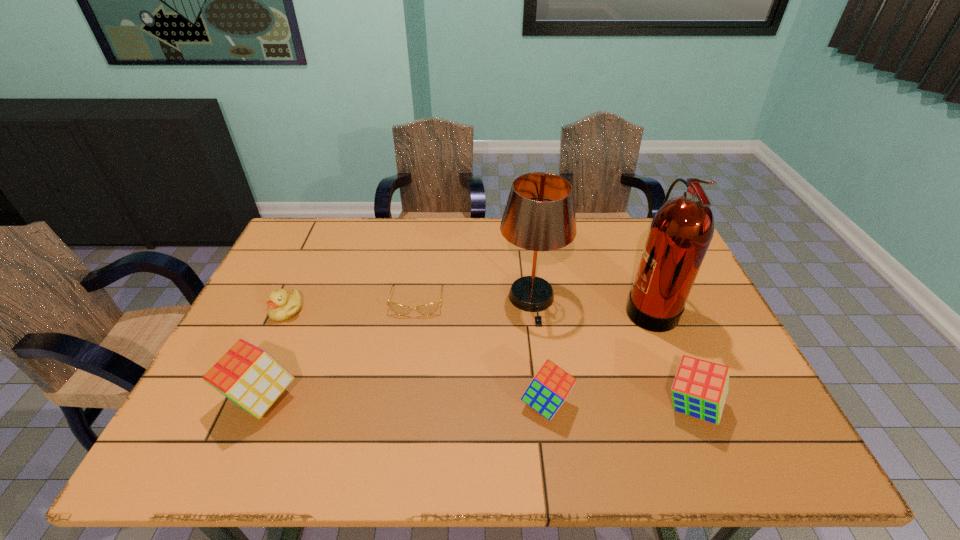
Find the location of a particular element. duckling at the left edge is located at coordinates (282, 305).

At what (x,y) coordinates should I click in order to perform the action: click on cube that is at the right edge. Please return your answer as a coordinate pair (x, y). Image resolution: width=960 pixels, height=540 pixels. Looking at the image, I should click on (700, 388).

Identify the location of fire extinguisher that is at the right edge. This screenshot has height=540, width=960. (681, 231).

You are a GUI agent. You are given a task and a screenshot of the screen. Output one action in this format:
    pyautogui.click(x=<x>, y=<y>)
    Task: Click on the object that is at the near left corner
    The width and height of the screenshot is (960, 540).
    Given the screenshot: What is the action you would take?
    pyautogui.click(x=250, y=377)

At what (x,y) coordinates should I click in order to perform the action: click on object located at the near right corner. Please return your answer as a coordinate pair (x, y). Looking at the image, I should click on (700, 388).

You are a GUI agent. You are given a task and a screenshot of the screen. Output one action in this format:
    pyautogui.click(x=<x>, y=<y>)
    Task: Click on the vacant space at the far edge of the desktop
    The width and height of the screenshot is (960, 540).
    Given the screenshot: What is the action you would take?
    pyautogui.click(x=477, y=241)

Locate an element on the screen. vacant space at the near edge of the desktop is located at coordinates (441, 420).

Identify the location of blank space at the right edge of the desktop. (713, 349).

The height and width of the screenshot is (540, 960). In the image, there is a desktop. Find the location of `vacant space at the far left corner`. vacant space at the far left corner is located at coordinates (332, 220).

Locate an element on the screen. free space that is in between the shortest object and the lampshade is located at coordinates pos(474,300).